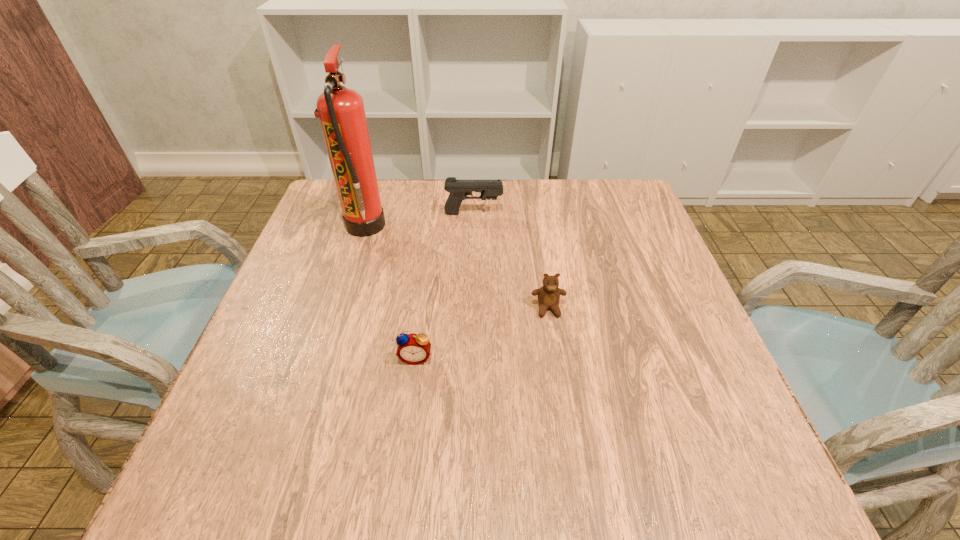
Find the location of a particular element. vacant area that lies between the nearest object and the fire extinguisher is located at coordinates (390, 292).

The image size is (960, 540). Find the location of `unoccupied position between the alarm clock and the second nearest object`. unoccupied position between the alarm clock and the second nearest object is located at coordinates pos(482,333).

This screenshot has height=540, width=960. Identify the location of free space that is in between the tallest object and the second nearest object. (456, 267).

You are a GUI agent. You are given a task and a screenshot of the screen. Output one action in this format:
    pyautogui.click(x=<x>, y=<y>)
    Task: Click on the vacant point located between the pistol and the alarm clock
    
    Given the screenshot: What is the action you would take?
    pyautogui.click(x=444, y=286)

At what (x,y) coordinates should I click in order to perform the action: click on free space between the nearest object and the rightmost object. Please return your answer as a coordinate pair (x, y). Looking at the image, I should click on (482, 333).

Identify the location of free spot between the tallest object and the alarm clock. (390, 292).

You are a GUI agent. You are given a task and a screenshot of the screen. Output one action in this format:
    pyautogui.click(x=<x>, y=<y>)
    Task: Click on the vacant point located between the pistol and the nearest object
    The image size is (960, 540).
    Given the screenshot: What is the action you would take?
    pyautogui.click(x=444, y=286)

Where is `free spot between the nearest object and the second tallest object`? This screenshot has width=960, height=540. free spot between the nearest object and the second tallest object is located at coordinates (444, 286).

Image resolution: width=960 pixels, height=540 pixels. I want to click on blank region between the tallest object and the pistol, so click(419, 220).

Select which object is the third closest to the teddy bear. Please provide its 2D coordinates. Your answer should be formatted as a tuple, i.e. [(x, y)], where the tuple contains the x and y coordinates of a point satisfying the conditions above.

[(341, 111)]